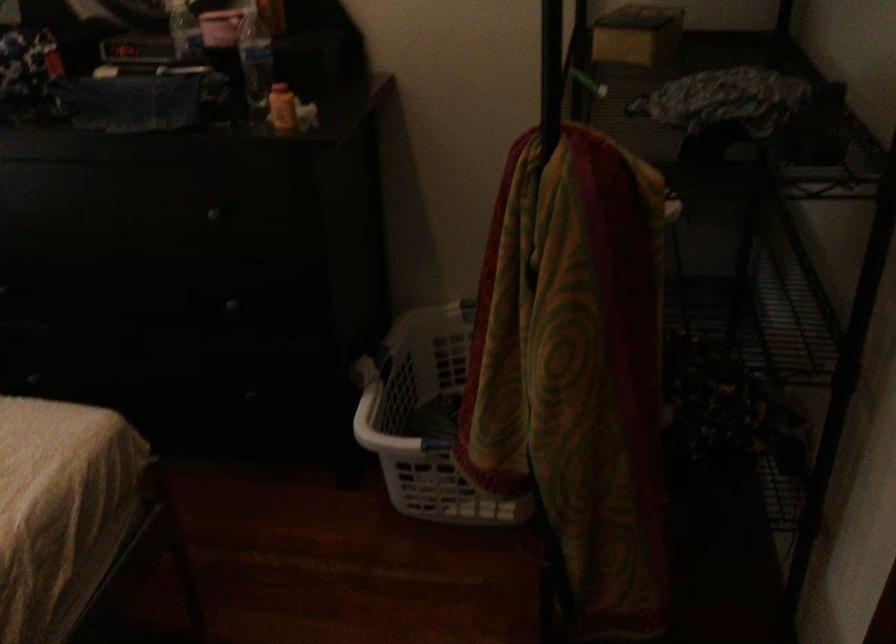
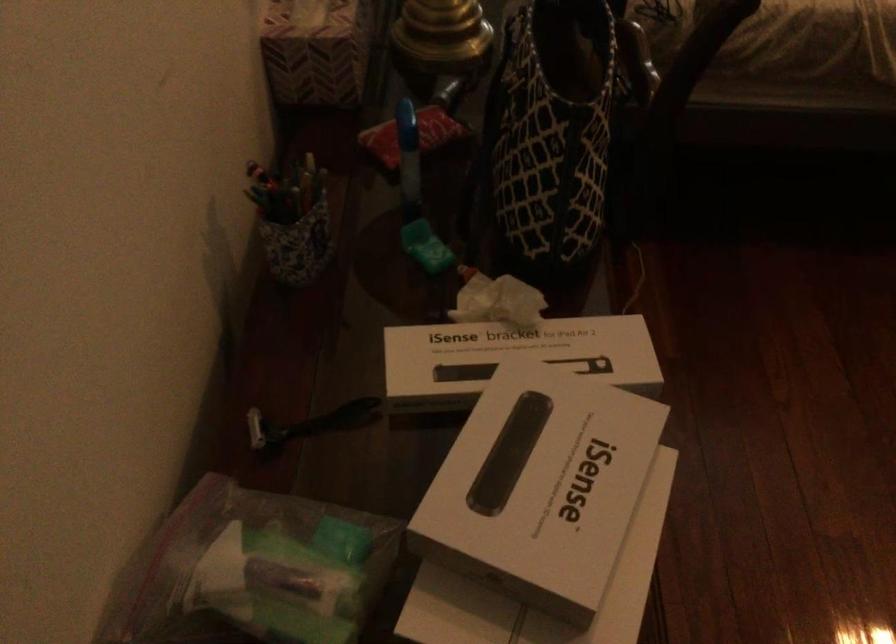
The images are taken continuously from a first-person perspective. In which direction is your viewpoint rotating?

The rotation direction of the camera is left-down.